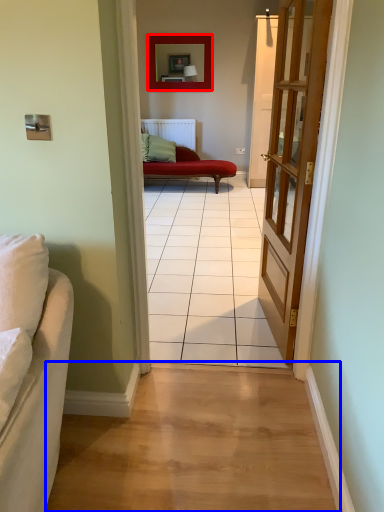
Question: Among these objects, which one is farthest to the camera, picture frame (highlighted by a red box) or path (highlighted by a blue box)?

Choices:
 (A) picture frame
 (B) path

Answer: (A)